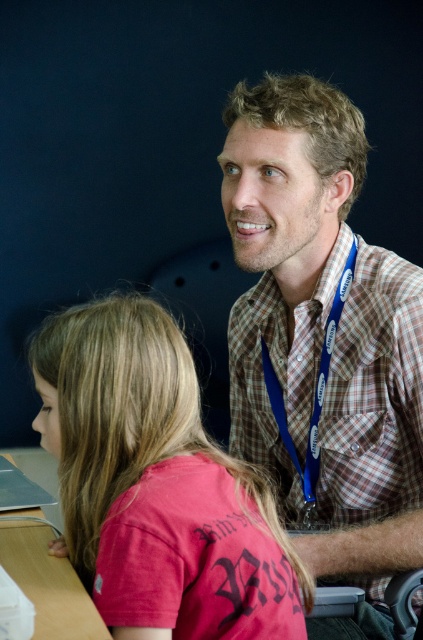
Does plaid shirt at upper right have a greater height compared to matte pink shirt at lower left?

Yes.

Who is shorter, plaid shirt at upper right or matte pink shirt at lower left?

With less height is matte pink shirt at lower left.

Where is `plaid shirt at upper right`? plaid shirt at upper right is located at coordinates (323, 340).

Does plaid shirt at upper right appear on the right side of wooden table at lower left?

Yes, plaid shirt at upper right is to the right of wooden table at lower left.

Does plaid shirt at upper right appear under wooden table at lower left?

No, plaid shirt at upper right is not below wooden table at lower left.

Identify the location of plaid shirt at upper right. The image size is (423, 640). (323, 340).

Can you confirm if matte pink shirt at lower left is shorter than wooden table at lower left?

No.

Which is in front, point (126, 468) or point (41, 449)?

Point (126, 468)

Where is `matte pink shirt at lower left`? The image size is (423, 640). matte pink shirt at lower left is located at coordinates (158, 484).